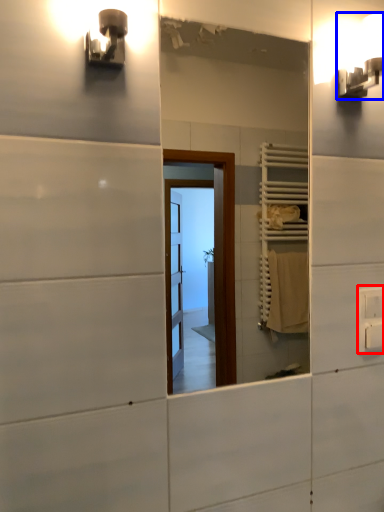
Question: Which point is closer to the camera, electric outlet (highlighted by a red box) or light fixture (highlighted by a blue box)?

Choices:
 (A) electric outlet
 (B) light fixture

Answer: (B)